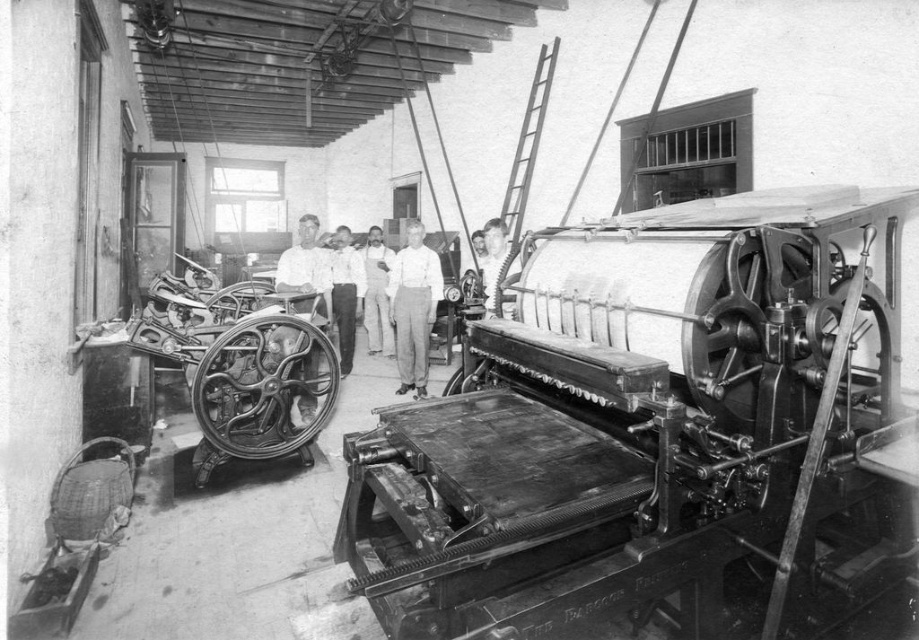
You are an inspector in this industrial setting and need to examine both the light gray cotton shirt at center and the white cotton overalls at center. Which one should you check first based on their positions?

You should check the light gray cotton shirt at center first because it is closer to you than the white cotton overalls at center.

You are an inspector in this industrial setting and need to check the clothing items. According to the scene, where is the light gray cotton pants at center in relation to the white cotton overalls at center?

The light gray cotton pants at center is to the right of the white cotton overalls at center.

What is the object located at the coordinates point (647, 428)?

The object at point (647, 428) is the metallic smooth printing press at center right.